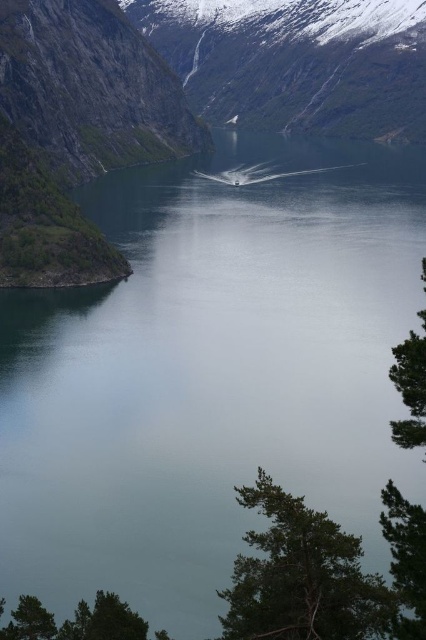
You are standing at the camera position observing the fjord scene. There is a point marked at coordinates point (296, 531). Can you determine if this point is within a safe distance for a drone to land, considering the drone has a minimum safe landing distance of 200 feet from the operator?

The point (296, 531) is 185.78 feet away from the camera, which is within the drone operator safety distance of 200 feet. Therefore, the point is within a safe distance for the drone to land.

From the picture: You are a hiker standing at the edge of the fjord and want to take a photo of both the green textured tree at lower right and the green textured tree at right. Which tree should you move closer to in order to capture both in the same frame?

To capture both the green textured tree at lower right and the green textured tree at right in the same frame, you should move closer to the green textured tree at lower right since it is positioned under the green textured tree at right, allowing both to be included in the photo when closer to the lower one.